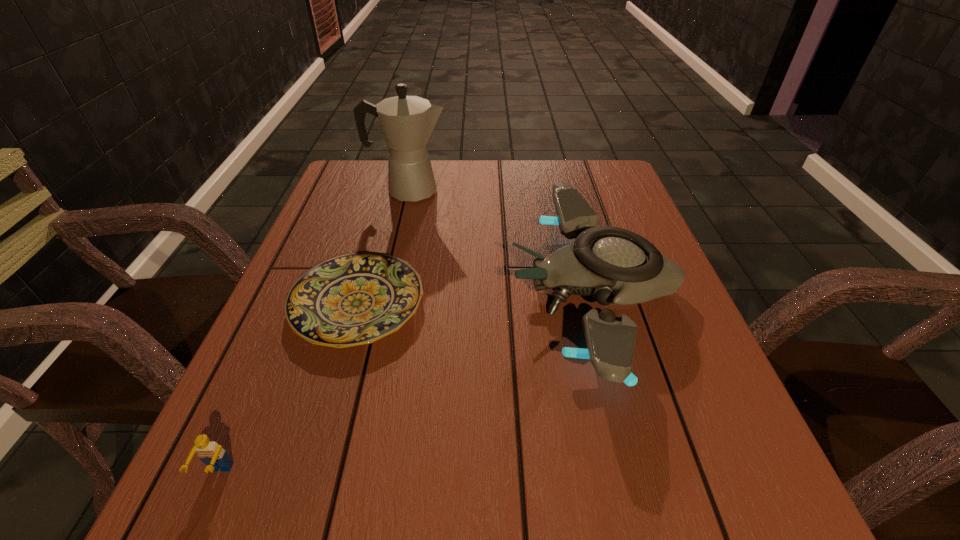
I want to click on object that is positioned at the near left corner, so click(x=212, y=454).

At what (x,y) coordinates should I click in order to perform the action: click on vacant space at the far edge of the desktop. Please return your answer as a coordinate pair (x, y). This screenshot has width=960, height=540. Looking at the image, I should click on (467, 160).

In the image, there is a desktop. Identify the location of vacant space at the near edge. (558, 472).

What are the coordinates of `vacant space at the left edge` in the screenshot? It's located at (320, 392).

Identify the location of vacant space at the right edge of the desktop. (668, 328).

This screenshot has height=540, width=960. In order to click on vacant space at the far left corner of the desktop in this screenshot , I will do (x=357, y=179).

Locate an element on the screen. vacant area at the far right corner is located at coordinates (612, 197).

I want to click on free space that is in between the shortest object and the drone, so click(x=476, y=297).

Image resolution: width=960 pixels, height=540 pixels. What are the coordinates of `free area in between the second shortest object and the rightmost object` in the screenshot? It's located at (406, 382).

Locate an element on the screen. The width and height of the screenshot is (960, 540). free point between the drone and the farthest object is located at coordinates (501, 240).